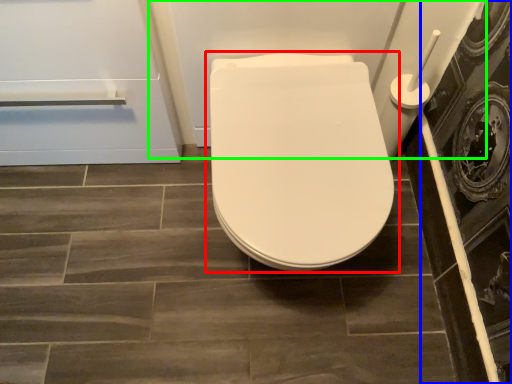
Question: Which object is the closest to the toilet (highlighted by a red box)? Choose among these: screen door (highlighted by a blue box) or bath (highlighted by a green box).

Choices:
 (A) screen door
 (B) bath

Answer: (B)